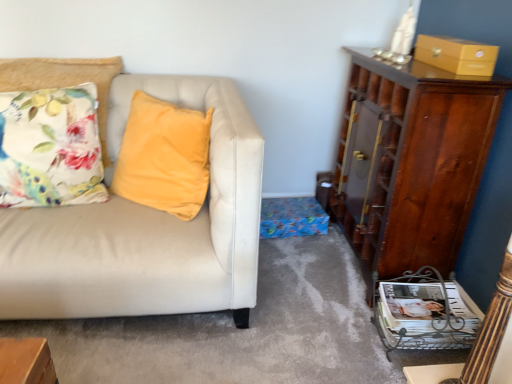
Question: Can you confirm if white glossy magazine at lower right is positioned to the left of shiny brown cabinet at right?

Choices:
 (A) yes
 (B) no

Answer: (A)

Question: Would you say white glossy magazine at lower right contains shiny brown cabinet at right?

Choices:
 (A) no
 (B) yes

Answer: (A)

Question: Considering the relative sizes of white glossy magazine at lower right and shiny brown cabinet at right in the image provided, is white glossy magazine at lower right taller than shiny brown cabinet at right?

Choices:
 (A) yes
 (B) no

Answer: (B)

Question: From a real-world perspective, is white glossy magazine at lower right on shiny brown cabinet at right?

Choices:
 (A) yes
 (B) no

Answer: (B)

Question: Is white glossy magazine at lower right behind shiny brown cabinet at right?

Choices:
 (A) yes
 (B) no

Answer: (A)

Question: Is there a large distance between white glossy magazine at lower right and shiny brown cabinet at right?

Choices:
 (A) yes
 (B) no

Answer: (B)

Question: Does floral fabric cushion at left appear on the left side of shiny brown cabinet at right?

Choices:
 (A) no
 (B) yes

Answer: (B)

Question: Does floral fabric cushion at left have a greater width compared to shiny brown cabinet at right?

Choices:
 (A) no
 (B) yes

Answer: (B)

Question: Would you say shiny brown cabinet at right is part of floral fabric cushion at left's contents?

Choices:
 (A) no
 (B) yes

Answer: (A)

Question: Is shiny brown cabinet at right at the back of floral fabric cushion at left?

Choices:
 (A) yes
 (B) no

Answer: (B)

Question: Does floral fabric cushion at left appear on the right side of shiny brown cabinet at right?

Choices:
 (A) yes
 (B) no

Answer: (B)

Question: Considering the relative sizes of floral fabric cushion at left and shiny brown cabinet at right in the image provided, is floral fabric cushion at left bigger than shiny brown cabinet at right?

Choices:
 (A) yes
 (B) no

Answer: (B)

Question: From the image's perspective, does floral fabric cushion at left appear lower than matte yellow box at upper right?

Choices:
 (A) no
 (B) yes

Answer: (B)